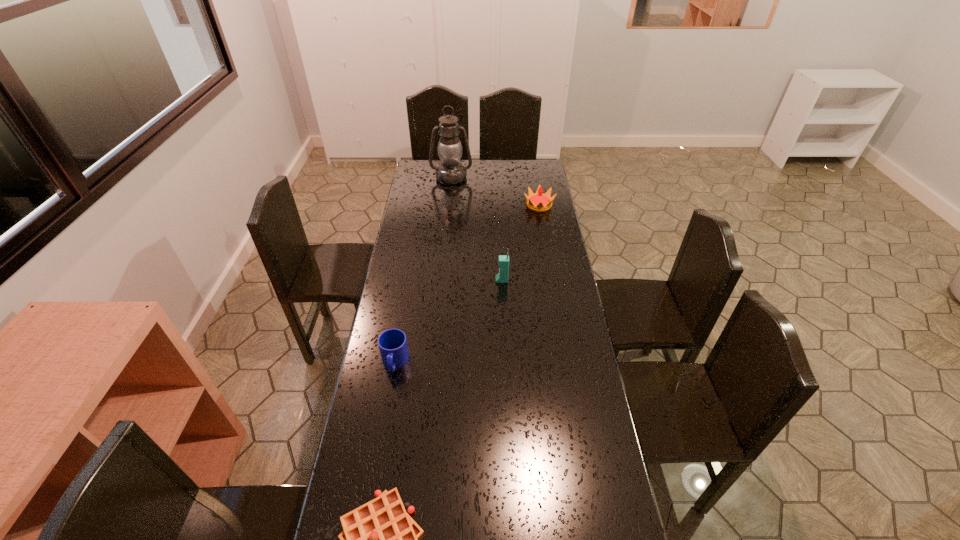
Where is `the farthest object`? This screenshot has height=540, width=960. the farthest object is located at coordinates (450, 171).

Locate an element on the screen. The image size is (960, 540). the tallest object is located at coordinates (450, 171).

You are a GUI agent. You are given a task and a screenshot of the screen. Output one action in this format:
    pyautogui.click(x=<x>, y=<y>)
    Task: Click on the fourth shortest object
    This screenshot has width=960, height=540.
    Given the screenshot: What is the action you would take?
    pyautogui.click(x=502, y=277)

The height and width of the screenshot is (540, 960). I want to click on cellular telephone, so click(502, 277).

This screenshot has width=960, height=540. Find the location of `the fourth nearest object`. the fourth nearest object is located at coordinates (538, 202).

Locate an element on the screen. crown is located at coordinates (538, 202).

Identify the location of the fourth tallest object. This screenshot has height=540, width=960. (392, 343).

The image size is (960, 540). Identify the location of the fourth farthest object. (392, 343).

The image size is (960, 540). Identify the location of vacant area situated 0.180m on the right of the farthest object. (506, 177).

Where is `free location located on the keypad of the fourth object from left to right`? The width and height of the screenshot is (960, 540). free location located on the keypad of the fourth object from left to right is located at coordinates (427, 280).